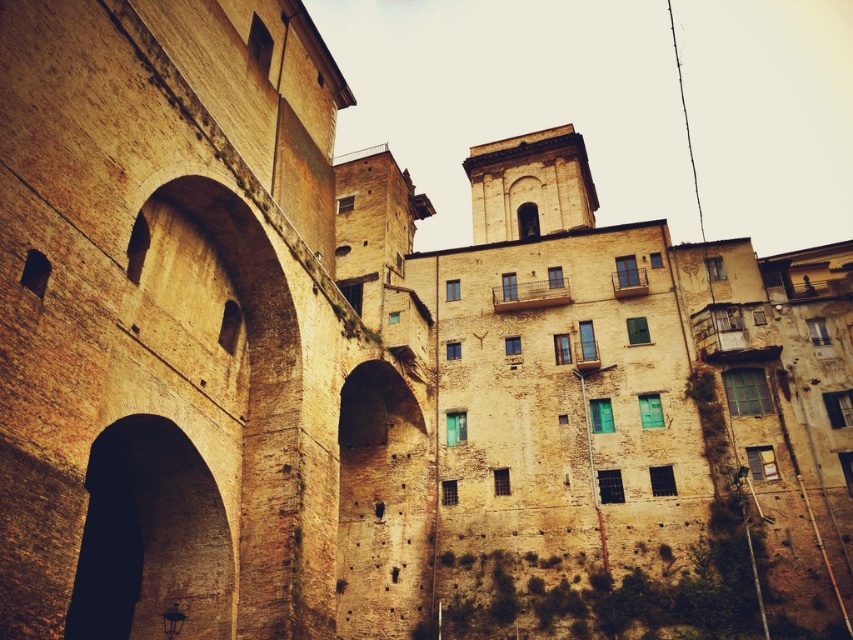
Question: Which of the following is the farthest from the observer?

Choices:
 (A) dark stone archway at lower left
 (B) brown rough stone archway at center

Answer: (B)

Question: Does dark stone archway at lower left have a smaller size compared to brown rough stone archway at center?

Choices:
 (A) yes
 (B) no

Answer: (A)

Question: Can you confirm if dark stone archway at lower left is thinner than brown rough stone archway at center?

Choices:
 (A) yes
 (B) no

Answer: (B)

Question: Which object appears closest to the camera in this image?

Choices:
 (A) brown rough stone archway at center
 (B) dark stone archway at lower left

Answer: (B)

Question: Does dark stone archway at lower left appear on the left side of brown rough stone archway at center?

Choices:
 (A) yes
 (B) no

Answer: (A)